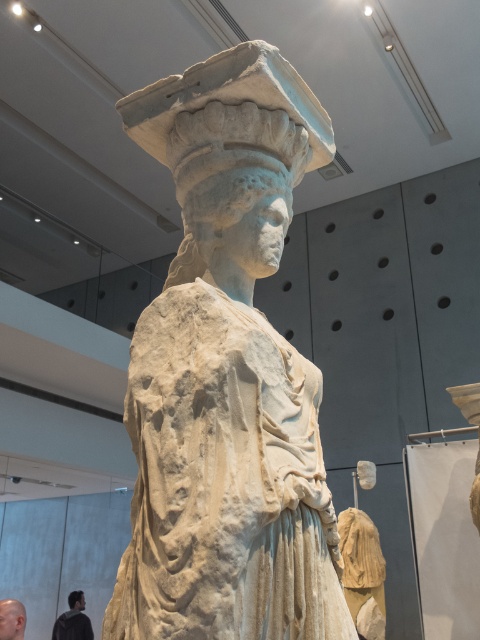
You are a museum curator examining the classical stone sculpture. You notice the white marble statue at center and the bald skin at lower left. Based on their positions, which object is placed above the other?

The white marble statue at center is positioned over bald skin at lower left, meaning the statue is above the bald skin.

You are a museum visitor standing in front of the white marble statue at center and the bald skin at lower left. Which object is closer to your left side?

The bald skin at lower left is closer to your left side because the white marble statue at center is positioned to its right.

You are a museum visitor standing in front of the classical stone sculpture. You notice the white marble head at center and the bald skin at lower left. Which object is closer to you?

The white marble head at center is closer to you because it is in front of the bald skin at lower left.